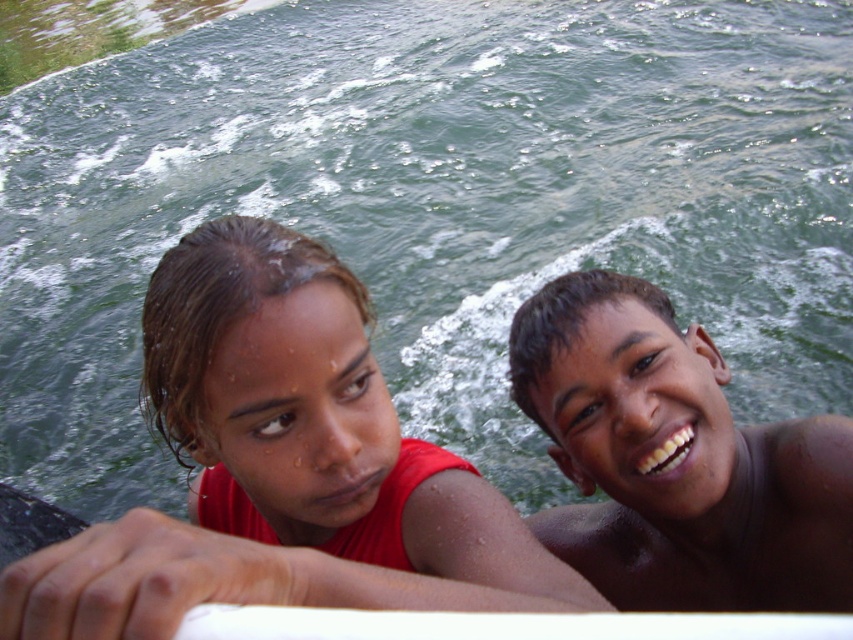
You are trying to identify clothing and skin tones in the scene. Which object is bigger in size between the matte red shirt at center and the brown shiny skin at upper right?

The matte red shirt at center is larger in size than the brown shiny skin at upper right.

You are a photographer trying to capture a clear shot of the matte red shirt at center and the brown shiny skin at upper right. Which object should you focus on first to ensure both are in focus?

The matte red shirt at center is in front of the brown shiny skin at upper right, so you should focus on the matte red shirt at center first to ensure both are in focus.

You are navigating a small boat and need to avoid the matte red shirt at center. Based on its coordinates, which direction should you steer to stay clear of it?

The matte red shirt at center is located at coordinates point (282,467). To avoid it, steer the boat away from the center towards the opposite direction of those coordinates.